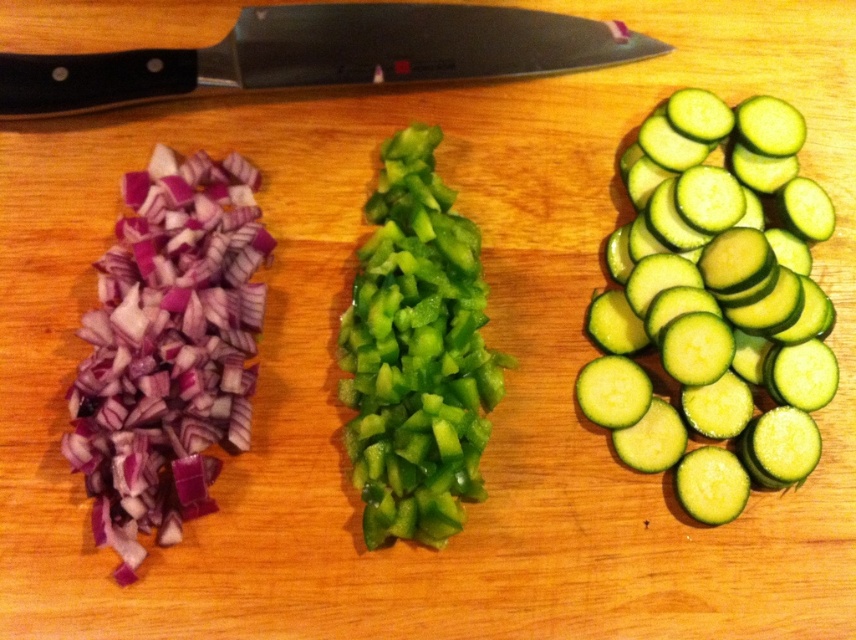
Can you confirm if matte purple onion at left is positioned to the right of black plastic knife at upper center?

In fact, matte purple onion at left is to the left of black plastic knife at upper center.

This screenshot has height=640, width=856. Find the location of `matte purple onion at left`. matte purple onion at left is located at coordinates pyautogui.click(x=168, y=349).

Which is in front, point (191, 392) or point (278, 17)?

Positioned in front is point (191, 392).

Locate an element on the screen. This screenshot has width=856, height=640. matte purple onion at left is located at coordinates (168, 349).

Where is `green glossy bell pepper at center`? The height and width of the screenshot is (640, 856). green glossy bell pepper at center is located at coordinates [x=417, y=353].

Does green glossy bell pepper at center have a lesser height compared to black plastic knife at upper center?

No, green glossy bell pepper at center is not shorter than black plastic knife at upper center.

This screenshot has width=856, height=640. In order to click on green glossy bell pepper at center in this screenshot , I will do `click(417, 353)`.

Identify the location of green glossy bell pepper at center. tap(417, 353).

Who is more forward, (x=696, y=516) or (x=223, y=204)?

Point (x=696, y=516) is more forward.

Between point (759, 189) and point (223, 228), which one is positioned behind?

The point (759, 189) is behind.

Locate an element on the screen. The width and height of the screenshot is (856, 640). green smooth cucumber at right is located at coordinates (715, 304).